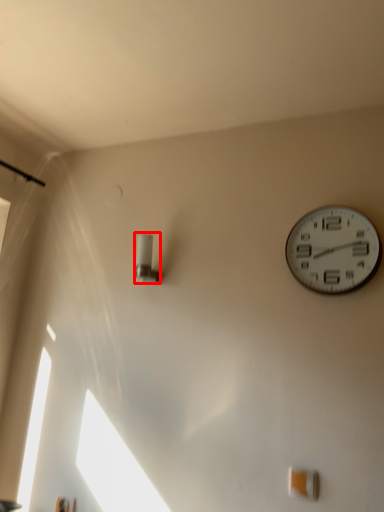
Question: Observing the image, what is the correct spatial positioning of light fixture (annotated by the red box) in reference to wall clock?

Choices:
 (A) left
 (B) right

Answer: (A)